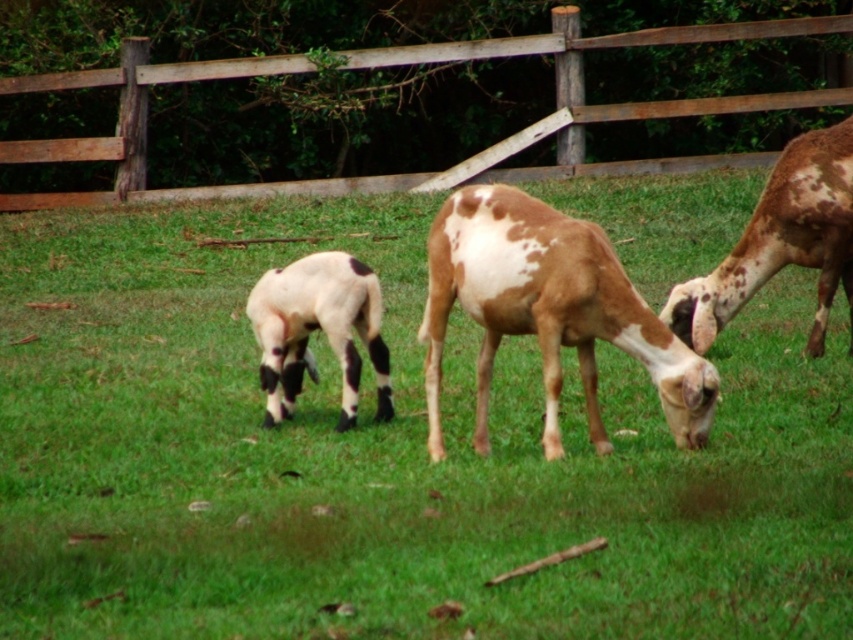
Is brown wooden fence at upper center to the right of brown and white spotted goat at center from the viewer's perspective?

Yes, brown wooden fence at upper center is to the right of brown and white spotted goat at center.

Who is positioned more to the right, brown wooden fence at upper center or brown and white spotted goat at center?

Positioned to the right is brown wooden fence at upper center.

Is point (396, 182) positioned in front of point (553, 378)?

No, it is behind (553, 378).

Where is `brown wooden fence at upper center`? The image size is (853, 640). brown wooden fence at upper center is located at coordinates (399, 65).

Is green grassy at center smaller than white woolen goat at center?

No, green grassy at center is not smaller than white woolen goat at center.

Is green grassy at center closer to the viewer compared to white woolen goat at center?

Yes, it is.

I want to click on green grassy at center, so click(x=386, y=458).

Find the location of `green grassy at center`. green grassy at center is located at coordinates (386, 458).

Does green grassy at center have a larger size compared to speckled fur goat at center?

Yes, green grassy at center is bigger than speckled fur goat at center.

How distant is green grassy at center from speckled fur goat at center?

The distance of green grassy at center from speckled fur goat at center is 9.44 feet.

Who is more distant from viewer, (86, 410) or (839, 122)?

The point (839, 122) is behind.

The height and width of the screenshot is (640, 853). I want to click on green grassy at center, so click(386, 458).